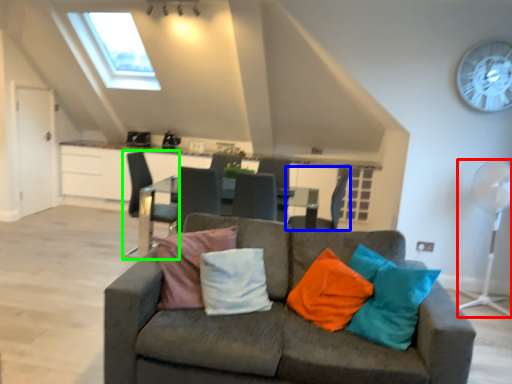
Question: Which object is the closest to the mechanical fan (highlighted by a red box)? Choose among these: chair (highlighted by a blue box) or chair (highlighted by a green box).

Choices:
 (A) chair
 (B) chair

Answer: (A)